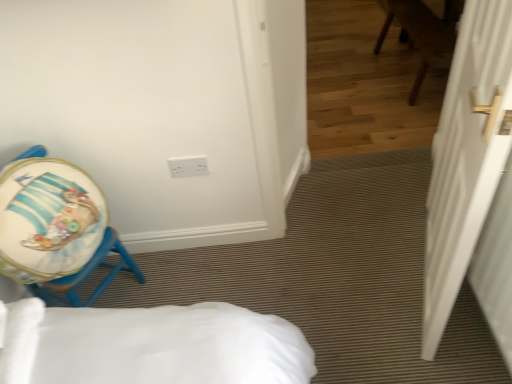
Where is `unoccupied space behind white matte door at right`? The width and height of the screenshot is (512, 384). unoccupied space behind white matte door at right is located at coordinates (377, 221).